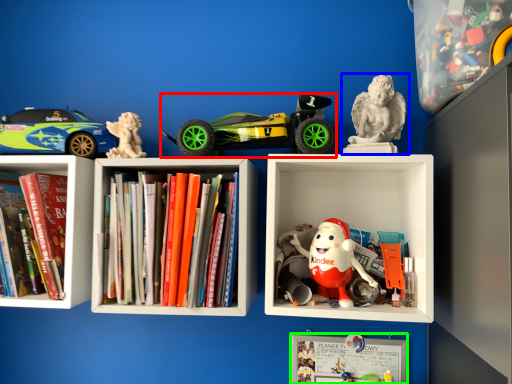
Question: Which object is the closest to the toy (highlighted by a red box)? Choose among these: toy (highlighted by a blue box) or bulletin board (highlighted by a green box).

Choices:
 (A) toy
 (B) bulletin board

Answer: (A)